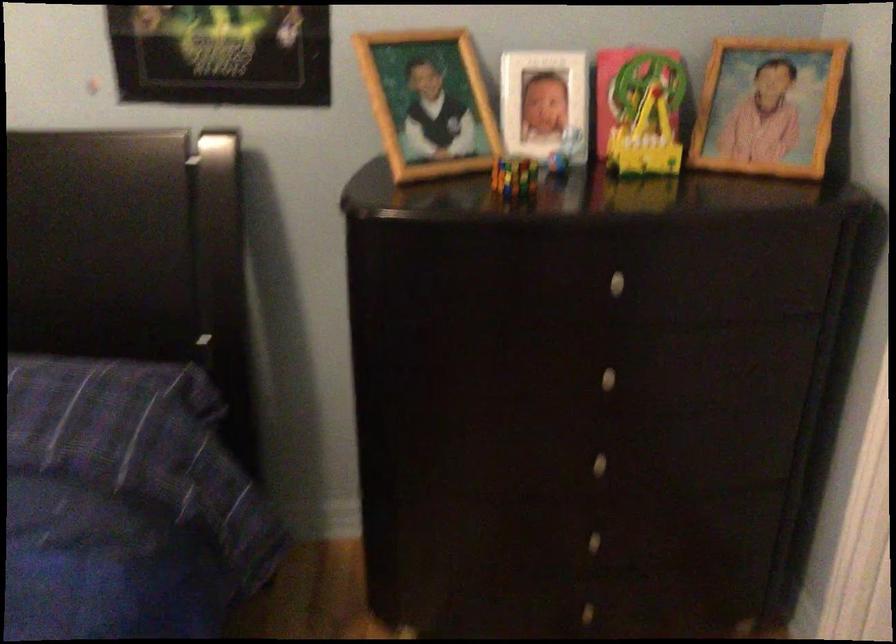
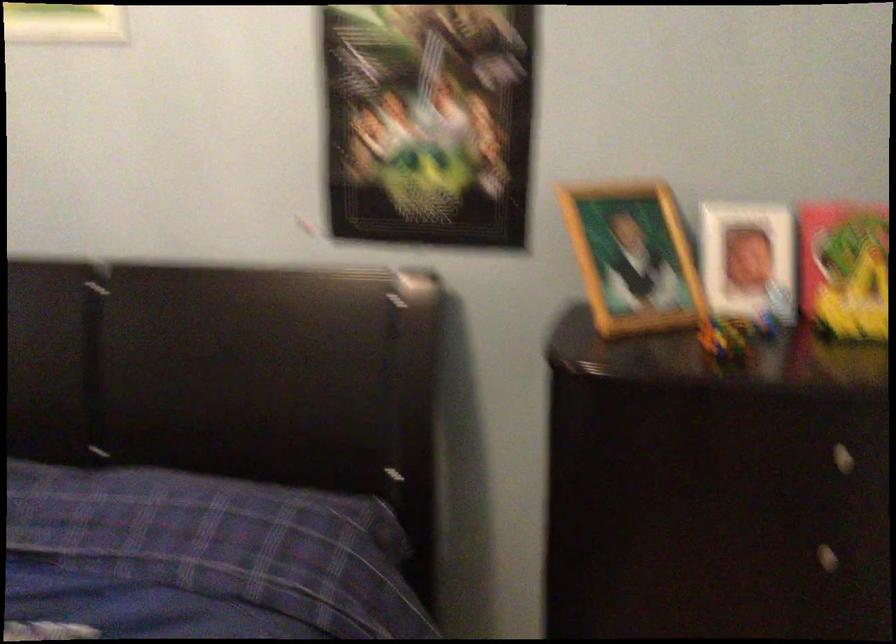
Where in the second image is the point corresponding to pixel 621 287 from the first image?

(840, 458)